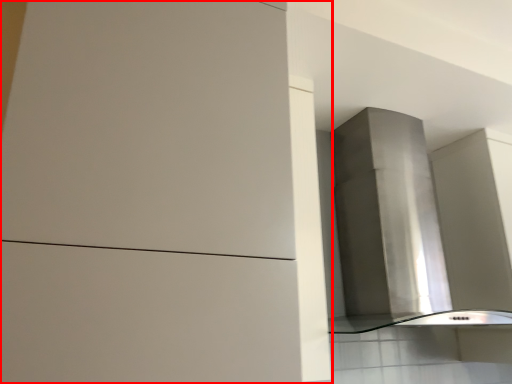
Question: From the image's perspective, what is the correct spatial relationship of cabinetry (annotated by the red box) in relation to vent?

Choices:
 (A) above
 (B) below

Answer: (A)